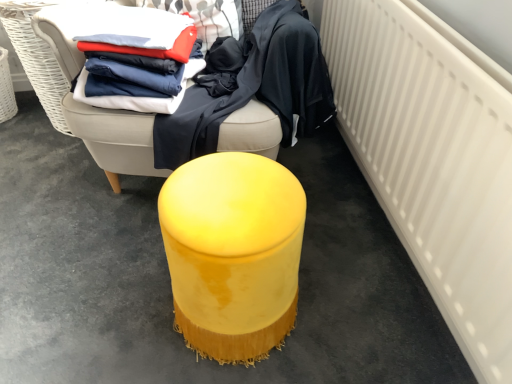
What do you see at coordinates (233, 253) in the screenshot?
I see `velvet yellow ottoman at center, the second furniture when ordered from top to bottom` at bounding box center [233, 253].

This screenshot has width=512, height=384. What do you see at coordinates (213, 102) in the screenshot?
I see `matte blue fabric at center, which is counted as the 2th clothing, starting from the left` at bounding box center [213, 102].

The height and width of the screenshot is (384, 512). Find the location of `matte cotton shirts at upper left, placed as the first clothing when sorted from left to right`. matte cotton shirts at upper left, placed as the first clothing when sorted from left to right is located at coordinates (136, 59).

Find the location of a particular element. The image size is (512, 384). velvet yellow ottoman at center, which ranks as the second furniture in bottom-to-top order is located at coordinates (114, 139).

I want to click on the 1st clothing behind the white matte radiator at right, starting your count from the anchor, so click(x=213, y=102).

Is white matte radiator at right facing towards matte blue fabric at center, which is counted as the 2th clothing, starting from the left?

Yes, white matte radiator at right is turned towards matte blue fabric at center, which is counted as the 2th clothing, starting from the left.

Based on the photo, who is bigger, white matte radiator at right or matte blue fabric at center, the 1th clothing from the right?

white matte radiator at right.

From a real-world perspective, between white matte radiator at right and matte blue fabric at center, which is counted as the 2th clothing, starting from the left, who is vertically higher?

matte blue fabric at center, which is counted as the 2th clothing, starting from the left, is physically above.

Which of these two, velvet yellow ottoman at center, positioned as the first furniture in top-to-bottom order, or matte blue fabric at center, the 1th clothing from the right, is bigger?

velvet yellow ottoman at center, positioned as the first furniture in top-to-bottom order, is bigger.

Considering the sizes of objects velvet yellow ottoman at center, positioned as the first furniture in top-to-bottom order, and matte blue fabric at center, which is counted as the 2th clothing, starting from the left, in the image provided, who is shorter, velvet yellow ottoman at center, positioned as the first furniture in top-to-bottom order, or matte blue fabric at center, which is counted as the 2th clothing, starting from the left,?

Standing shorter between the two is matte blue fabric at center, which is counted as the 2th clothing, starting from the left.

Does velvet yellow ottoman at center, positioned as the first furniture in top-to-bottom order, come behind matte blue fabric at center, the 1th clothing from the right?

No, velvet yellow ottoman at center, positioned as the first furniture in top-to-bottom order, is in front of matte blue fabric at center, the 1th clothing from the right.

Which is less distant, (x=70, y=62) or (x=169, y=157)?

The point (x=70, y=62) is more forward.

Is matte blue fabric at center, the 1th clothing from the right, inside or outside of matte cotton shirts at upper left, arranged as the second clothing when viewed from the right?

matte blue fabric at center, the 1th clothing from the right, lies outside matte cotton shirts at upper left, arranged as the second clothing when viewed from the right.

Is matte blue fabric at center, the 1th clothing from the right, next to matte cotton shirts at upper left, arranged as the second clothing when viewed from the right, and touching it?

No, matte blue fabric at center, the 1th clothing from the right, is not touching matte cotton shirts at upper left, arranged as the second clothing when viewed from the right.

Can you confirm if matte blue fabric at center, which is counted as the 2th clothing, starting from the left, is wider than matte cotton shirts at upper left, arranged as the second clothing when viewed from the right?

Yes.

What's the angular difference between matte blue fabric at center, which is counted as the 2th clothing, starting from the left, and matte cotton shirts at upper left, placed as the first clothing when sorted from left to right,'s facing directions?

The angular difference between matte blue fabric at center, which is counted as the 2th clothing, starting from the left, and matte cotton shirts at upper left, placed as the first clothing when sorted from left to right, is 19 degrees.

Between velvet yellow ottoman at center, the second furniture when ordered from top to bottom, and white matte radiator at right, which one appears on the right side from the viewer's perspective?

Positioned to the right is white matte radiator at right.

Who is bigger, velvet yellow ottoman at center, placed as the 1th furniture when sorted from bottom to top, or white matte radiator at right?

white matte radiator at right.

Is velvet yellow ottoman at center, placed as the 1th furniture when sorted from bottom to top, shorter than white matte radiator at right?

Yes, velvet yellow ottoman at center, placed as the 1th furniture when sorted from bottom to top, is shorter than white matte radiator at right.

Which furniture is the 1st one when counting from the left side of the white matte radiator at right? Please provide its 2D coordinates.

[(233, 253)]

From a real-world perspective, which is physically below, velvet yellow ottoman at center, which ranks as the second furniture in bottom-to-top order, or matte cotton shirts at upper left, placed as the first clothing when sorted from left to right?

From a 3D spatial view, velvet yellow ottoman at center, which ranks as the second furniture in bottom-to-top order, is below.

Is velvet yellow ottoman at center, which ranks as the second furniture in bottom-to-top order, placed right next to matte cotton shirts at upper left, placed as the first clothing when sorted from left to right?

No, velvet yellow ottoman at center, which ranks as the second furniture in bottom-to-top order, is not with matte cotton shirts at upper left, placed as the first clothing when sorted from left to right.

Is point (102, 126) behind point (149, 54)?

Yes, point (102, 126) is farther from viewer.

Consider the image. Is velvet yellow ottoman at center, placed as the 1th furniture when sorted from bottom to top, inside the boundaries of matte cotton shirts at upper left, arranged as the second clothing when viewed from the right, or outside?

velvet yellow ottoman at center, placed as the 1th furniture when sorted from bottom to top, is spatially situated outside matte cotton shirts at upper left, arranged as the second clothing when viewed from the right.

Considering the relative sizes of velvet yellow ottoman at center, placed as the 1th furniture when sorted from bottom to top, and matte cotton shirts at upper left, placed as the first clothing when sorted from left to right, in the image provided, is velvet yellow ottoman at center, placed as the 1th furniture when sorted from bottom to top, bigger than matte cotton shirts at upper left, placed as the first clothing when sorted from left to right,?

Correct, velvet yellow ottoman at center, placed as the 1th furniture when sorted from bottom to top, is larger in size than matte cotton shirts at upper left, placed as the first clothing when sorted from left to right.

Which is more to the left, velvet yellow ottoman at center, the second furniture when ordered from top to bottom, or matte cotton shirts at upper left, placed as the first clothing when sorted from left to right?

From the viewer's perspective, matte cotton shirts at upper left, placed as the first clothing when sorted from left to right, appears more on the left side.

From a real-world perspective, is velvet yellow ottoman at center, the second furniture when ordered from top to bottom, physically located above or below matte cotton shirts at upper left, arranged as the second clothing when viewed from the right?

velvet yellow ottoman at center, the second furniture when ordered from top to bottom, is below matte cotton shirts at upper left, arranged as the second clothing when viewed from the right.

Is matte cotton shirts at upper left, placed as the first clothing when sorted from left to right, inside or outside of velvet yellow ottoman at center, the second furniture when ordered from top to bottom?

The correct answer is: outside.

Where is `clothing on the left of velvet yellow ottoman at center, the second furniture when ordered from top to bottom`? The image size is (512, 384). clothing on the left of velvet yellow ottoman at center, the second furniture when ordered from top to bottom is located at coordinates (136, 59).

Is matte cotton shirts at upper left, placed as the first clothing when sorted from left to right, oriented away from velvet yellow ottoman at center, the second furniture when ordered from top to bottom?

No.

From the image's perspective, which object appears higher, matte cotton shirts at upper left, arranged as the second clothing when viewed from the right, or velvet yellow ottoman at center, placed as the 1th furniture when sorted from bottom to top?

matte cotton shirts at upper left, arranged as the second clothing when viewed from the right, from the image's perspective.

Locate an element on the screen. Image resolution: width=512 pixels, height=384 pixels. radiator located below the matte blue fabric at center, the 1th clothing from the right (from the image's perspective) is located at coordinates (433, 158).

You are a GUI agent. You are given a task and a screenshot of the screen. Output one action in this format:
    pyautogui.click(x=<x>, y=<y>)
    Task: Click on the furniture located above the matte blue fabric at center, the 1th clothing from the right (from the image's perspective)
    
    Given the screenshot: What is the action you would take?
    pyautogui.click(x=114, y=139)

Based on their spatial positions, is velvet yellow ottoman at center, the second furniture when ordered from top to bottom, or white matte radiator at right further from matte blue fabric at center, which is counted as the 2th clothing, starting from the left?

Based on the image, white matte radiator at right appears to be further to matte blue fabric at center, which is counted as the 2th clothing, starting from the left.

Considering their positions, is velvet yellow ottoman at center, which ranks as the second furniture in bottom-to-top order, positioned closer to matte cotton shirts at upper left, placed as the first clothing when sorted from left to right, than velvet yellow ottoman at center, placed as the 1th furniture when sorted from bottom to top?

The object closer to matte cotton shirts at upper left, placed as the first clothing when sorted from left to right, is velvet yellow ottoman at center, which ranks as the second furniture in bottom-to-top order.

Based on the photo, considering their positions, is matte cotton shirts at upper left, placed as the first clothing when sorted from left to right, positioned closer to velvet yellow ottoman at center, the second furniture when ordered from top to bottom, than velvet yellow ottoman at center, which ranks as the second furniture in bottom-to-top order?

Based on the image, velvet yellow ottoman at center, which ranks as the second furniture in bottom-to-top order, appears to be nearer to velvet yellow ottoman at center, the second furniture when ordered from top to bottom.

When comparing their distances from matte cotton shirts at upper left, placed as the first clothing when sorted from left to right, does white matte radiator at right or velvet yellow ottoman at center, which ranks as the second furniture in bottom-to-top order, seem closer?

velvet yellow ottoman at center, which ranks as the second furniture in bottom-to-top order, lies closer to matte cotton shirts at upper left, placed as the first clothing when sorted from left to right, than the other object.

Which object lies further to the anchor point matte blue fabric at center, the 1th clothing from the right, velvet yellow ottoman at center, positioned as the first furniture in top-to-bottom order, or matte cotton shirts at upper left, placed as the first clothing when sorted from left to right?

The object further to matte blue fabric at center, the 1th clothing from the right, is matte cotton shirts at upper left, placed as the first clothing when sorted from left to right.

Which object lies nearer to the anchor point white matte radiator at right, velvet yellow ottoman at center, positioned as the first furniture in top-to-bottom order, or matte cotton shirts at upper left, arranged as the second clothing when viewed from the right?

Based on the image, velvet yellow ottoman at center, positioned as the first furniture in top-to-bottom order, appears to be nearer to white matte radiator at right.

When comparing their distances from velvet yellow ottoman at center, the second furniture when ordered from top to bottom, does matte blue fabric at center, the 1th clothing from the right, or white matte radiator at right seem further?

Among the two, white matte radiator at right is located further to velvet yellow ottoman at center, the second furniture when ordered from top to bottom.

Based on the photo, from the image, which object appears to be farther from white matte radiator at right, matte blue fabric at center, which is counted as the 2th clothing, starting from the left, or velvet yellow ottoman at center, the second furniture when ordered from top to bottom?

matte blue fabric at center, which is counted as the 2th clothing, starting from the left, is further to white matte radiator at right.

Image resolution: width=512 pixels, height=384 pixels. In order to click on furniture situated between velvet yellow ottoman at center, which ranks as the second furniture in bottom-to-top order, and white matte radiator at right from left to right in this screenshot , I will do `click(233, 253)`.

The width and height of the screenshot is (512, 384). Find the location of `clothing that lies between matte cotton shirts at upper left, placed as the first clothing when sorted from left to right, and velvet yellow ottoman at center, the second furniture when ordered from top to bottom, from top to bottom`. clothing that lies between matte cotton shirts at upper left, placed as the first clothing when sorted from left to right, and velvet yellow ottoman at center, the second furniture when ordered from top to bottom, from top to bottom is located at coordinates (213, 102).

The image size is (512, 384). In order to click on clothing between velvet yellow ottoman at center, the second furniture when ordered from top to bottom, and white matte radiator at right from left to right in this screenshot , I will do `click(213, 102)`.

In order to click on clothing between matte cotton shirts at upper left, placed as the first clothing when sorted from left to right, and white matte radiator at right from left to right in this screenshot , I will do `click(213, 102)`.